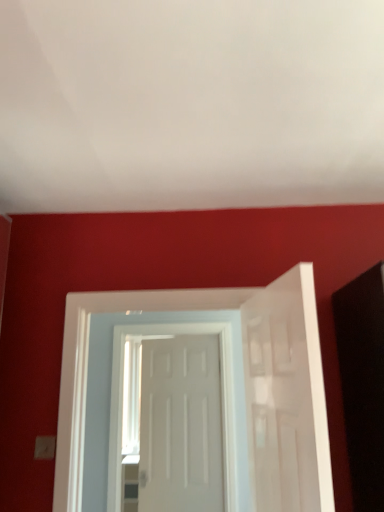
The height and width of the screenshot is (512, 384). I want to click on white matte door at center, marked as the 3th door in a front-to-back arrangement, so tap(181, 425).

I want to click on white matte door at center, marked as the 3th door in a front-to-back arrangement, so click(181, 425).

Considering the sizes of objects white matte door at right, the 3th door when ordered from back to front, and white glossy door at center, acting as the 2th door starting from the back, in the image provided, who is bigger, white matte door at right, the 3th door when ordered from back to front, or white glossy door at center, acting as the 2th door starting from the back,?

white glossy door at center, acting as the 2th door starting from the back, is bigger.

Can you confirm if white matte door at right, the 3th door when ordered from back to front, is taller than white glossy door at center, acting as the 2th door starting from the back?

Incorrect, the height of white matte door at right, the 3th door when ordered from back to front, is not larger of that of white glossy door at center, acting as the 2th door starting from the back.

Considering the sizes of white matte door at right, marked as the first door in a front-to-back arrangement, and white glossy door at center, which is counted as the 2th door, starting from the front, in the image, is white matte door at right, marked as the first door in a front-to-back arrangement, wider or thinner than white glossy door at center, which is counted as the 2th door, starting from the front,?

Considering their sizes, white matte door at right, marked as the first door in a front-to-back arrangement, looks broader than white glossy door at center, which is counted as the 2th door, starting from the front.

Considering the relative sizes of white matte door at center, the 1th door viewed from the back, and white glossy door at center, which is counted as the 2th door, starting from the front, in the image provided, is white matte door at center, the 1th door viewed from the back, thinner than white glossy door at center, which is counted as the 2th door, starting from the front,?

Correct, the width of white matte door at center, the 1th door viewed from the back, is less than that of white glossy door at center, which is counted as the 2th door, starting from the front.

From a real-world perspective, is white matte door at center, marked as the 3th door in a front-to-back arrangement, over white glossy door at center, which is counted as the 2th door, starting from the front?

No, from a real-world perspective, white matte door at center, marked as the 3th door in a front-to-back arrangement, is not over white glossy door at center, which is counted as the 2th door, starting from the front

Is white matte door at center, the 1th door viewed from the back, taller than white glossy door at center, acting as the 2th door starting from the back?

Correct, white matte door at center, the 1th door viewed from the back, is much taller as white glossy door at center, acting as the 2th door starting from the back.

From the image's perspective, between white matte door at center, marked as the 3th door in a front-to-back arrangement, and white glossy door at center, acting as the 2th door starting from the back, which one is located above?

white glossy door at center, acting as the 2th door starting from the back, is shown above in the image.

From the image's perspective, between white glossy door at center, acting as the 2th door starting from the back, and white matte door at center, the 1th door viewed from the back, which one is located above?

white glossy door at center, acting as the 2th door starting from the back, from the image's perspective.

From a real-world perspective, which object stands above the other?

white glossy door at center, which is counted as the 2th door, starting from the front, from a real-world perspective.

Is white glossy door at center, acting as the 2th door starting from the back, not near white matte door at center, marked as the 3th door in a front-to-back arrangement?

white glossy door at center, acting as the 2th door starting from the back, is near white matte door at center, marked as the 3th door in a front-to-back arrangement, not far away.

Which is more to the left, white glossy door at center, acting as the 2th door starting from the back, or white matte door at center, the 1th door viewed from the back?

From the viewer's perspective, white glossy door at center, acting as the 2th door starting from the back, appears more on the left side.

Is white glossy door at center, which is counted as the 2th door, starting from the front, behind white matte door at right, marked as the first door in a front-to-back arrangement?

Yes.

From the image's perspective, is white glossy door at center, which is counted as the 2th door, starting from the front, located above or below white matte door at right, marked as the first door in a front-to-back arrangement?

white glossy door at center, which is counted as the 2th door, starting from the front, is below white matte door at right, marked as the first door in a front-to-back arrangement.

Looking at the image, does white glossy door at center, acting as the 2th door starting from the back, seem bigger or smaller compared to white matte door at right, marked as the first door in a front-to-back arrangement?

In the image, white glossy door at center, acting as the 2th door starting from the back, appears to be larger than white matte door at right, marked as the first door in a front-to-back arrangement.

Where is `door that is the 2nd object to the left of the white matte door at right, marked as the first door in a front-to-back arrangement, starting at the anchor`? door that is the 2nd object to the left of the white matte door at right, marked as the first door in a front-to-back arrangement, starting at the anchor is located at coordinates (197, 397).

Considering the sizes of objects white matte door at right, marked as the first door in a front-to-back arrangement, and white matte door at center, the 1th door viewed from the back, in the image provided, who is wider, white matte door at right, marked as the first door in a front-to-back arrangement, or white matte door at center, the 1th door viewed from the back,?

white matte door at right, marked as the first door in a front-to-back arrangement.

Would you say white matte door at right, the 3th door when ordered from back to front, is inside or outside white matte door at center, marked as the 3th door in a front-to-back arrangement?

white matte door at right, the 3th door when ordered from back to front, lies outside white matte door at center, marked as the 3th door in a front-to-back arrangement.

Looking at this image, is white matte door at right, marked as the first door in a front-to-back arrangement, to the left of white matte door at center, the 1th door viewed from the back, from the viewer's perspective?

Incorrect, white matte door at right, marked as the first door in a front-to-back arrangement, is not on the left side of white matte door at center, the 1th door viewed from the back.

Are white matte door at right, marked as the first door in a front-to-back arrangement, and white matte door at center, marked as the 3th door in a front-to-back arrangement, beside each other?

No, white matte door at right, marked as the first door in a front-to-back arrangement, is not making contact with white matte door at center, marked as the 3th door in a front-to-back arrangement.

Considering the points (197, 411) and (263, 467), which point is behind, point (197, 411) or point (263, 467)?

Point (197, 411)

From a real-world perspective, is white matte door at center, marked as the 3th door in a front-to-back arrangement, on top of white matte door at right, marked as the first door in a front-to-back arrangement?

Incorrect, from a real-world perspective, white matte door at center, marked as the 3th door in a front-to-back arrangement, is lower than white matte door at right, marked as the first door in a front-to-back arrangement.

How many degrees apart are the facing directions of white matte door at center, the 1th door viewed from the back, and white matte door at right, the 3th door when ordered from back to front?

There is a 51.8-degree angle between the facing directions of white matte door at center, the 1th door viewed from the back, and white matte door at right, the 3th door when ordered from back to front.

Starting from the white matte door at right, the 3th door when ordered from back to front, which door is the 2nd one to the left? Please provide its 2D coordinates.

[(197, 397)]

Identify the location of door that is the 1st one when counting forward from the white matte door at center, marked as the 3th door in a front-to-back arrangement. This screenshot has height=512, width=384. (197, 397).

Looking at the image, which one is located further to white matte door at center, marked as the 3th door in a front-to-back arrangement, white glossy door at center, acting as the 2th door starting from the back, or white matte door at right, marked as the first door in a front-to-back arrangement?

white matte door at right, marked as the first door in a front-to-back arrangement.

Considering their positions, is white glossy door at center, acting as the 2th door starting from the back, positioned further to white matte door at right, marked as the first door in a front-to-back arrangement, than white matte door at center, the 1th door viewed from the back?

white matte door at center, the 1th door viewed from the back, lies further to white matte door at right, marked as the first door in a front-to-back arrangement, than the other object.

Consider the image. Which object lies further to the anchor point white matte door at right, the 3th door when ordered from back to front, white matte door at center, marked as the 3th door in a front-to-back arrangement, or white glossy door at center, acting as the 2th door starting from the back?

Among the two, white matte door at center, marked as the 3th door in a front-to-back arrangement, is located further to white matte door at right, the 3th door when ordered from back to front.

Estimate the real-world distances between objects in this image. Which object is further from white glossy door at center, acting as the 2th door starting from the back, white matte door at center, marked as the 3th door in a front-to-back arrangement, or white matte door at right, marked as the first door in a front-to-back arrangement?

The object further to white glossy door at center, acting as the 2th door starting from the back, is white matte door at right, marked as the first door in a front-to-back arrangement.

Considering their positions, is white matte door at right, the 3th door when ordered from back to front, positioned further to white glossy door at center, acting as the 2th door starting from the back, than white matte door at center, the 1th door viewed from the back?

white matte door at right, the 3th door when ordered from back to front, lies further to white glossy door at center, acting as the 2th door starting from the back, than the other object.

Looking at the image, which one is located further to white matte door at center, marked as the 3th door in a front-to-back arrangement, white matte door at right, marked as the first door in a front-to-back arrangement, or white glossy door at center, acting as the 2th door starting from the back?

white matte door at right, marked as the first door in a front-to-back arrangement, lies further to white matte door at center, marked as the 3th door in a front-to-back arrangement, than the other object.

Find the location of a particular element. door located between white matte door at right, the 3th door when ordered from back to front, and white matte door at center, the 1th door viewed from the back, in the depth direction is located at coordinates (197, 397).